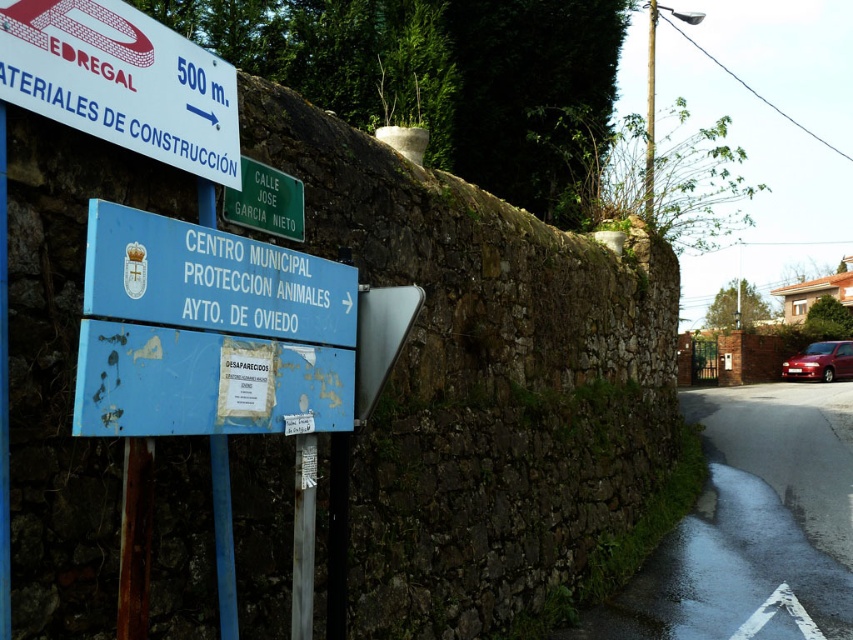
Is white plastic sign at upper left to the right of blue painted metal sign at center from the viewer's perspective?

In fact, white plastic sign at upper left is to the left of blue painted metal sign at center.

Which is more to the left, white plastic sign at upper left or blue painted metal sign at center?

white plastic sign at upper left is more to the left.

Which is in front, point (183, 83) or point (231, 280)?

Point (231, 280) is more forward.

Find the location of a particular element. The height and width of the screenshot is (640, 853). white plastic sign at upper left is located at coordinates (120, 81).

Can you confirm if green plastic street sign at upper center is wider than shiny red car at right?

No.

The width and height of the screenshot is (853, 640). What do you see at coordinates (265, 202) in the screenshot?
I see `green plastic street sign at upper center` at bounding box center [265, 202].

The height and width of the screenshot is (640, 853). I want to click on green plastic street sign at upper center, so click(x=265, y=202).

Between point (245, 300) and point (253, 164), which one is positioned in front?

Point (245, 300) is in front.

Based on the photo, is blue painted metal sign at center wider than green plastic street sign at upper center?

Yes.

What are the coordinates of `blue painted metal sign at center` in the screenshot? It's located at (212, 280).